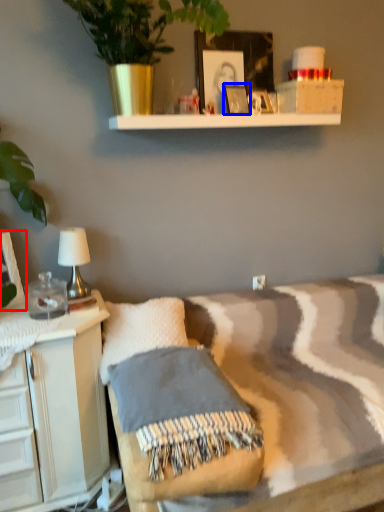
Question: Which point is further to the camera, picture frame (highlighted by a red box) or picture frame (highlighted by a blue box)?

Choices:
 (A) picture frame
 (B) picture frame

Answer: (B)